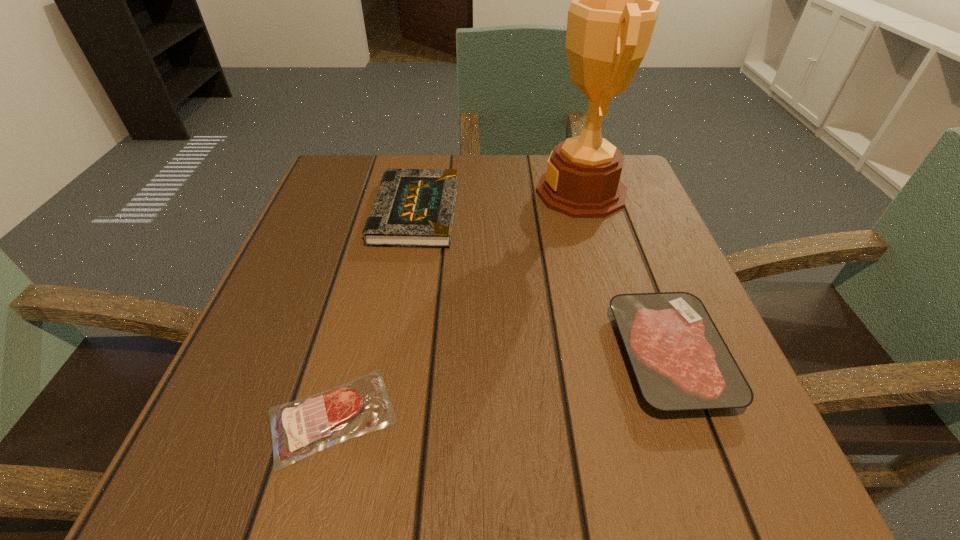
Find the location of a particular element. This screenshot has height=540, width=960. the second closest object to the second shortest object is located at coordinates (x=414, y=207).

You are a GUI agent. You are given a task and a screenshot of the screen. Output one action in this format:
    pyautogui.click(x=<x>, y=<y>)
    Task: Click on the object that is the second closest to the third tallest object
    
    Given the screenshot: What is the action you would take?
    pyautogui.click(x=414, y=207)

At what (x,y) coordinates should I click in order to perform the action: click on free region that satisfies the following two spatial constraints: 1. on the front-facing side of the taller steak; 2. on the left side of the tallest object. Please return your answer as a coordinate pair (x, y). Looking at the image, I should click on (629, 356).

The height and width of the screenshot is (540, 960). I want to click on vacant area that satisfies the following two spatial constraints: 1. on the front-facing side of the taller steak; 2. on the left side of the tallest object, so click(629, 356).

This screenshot has height=540, width=960. Find the location of `free space in the image that satisfies the following two spatial constraints: 1. on the front-facing side of the taller steak; 2. on the right side of the award`. free space in the image that satisfies the following two spatial constraints: 1. on the front-facing side of the taller steak; 2. on the right side of the award is located at coordinates (629, 356).